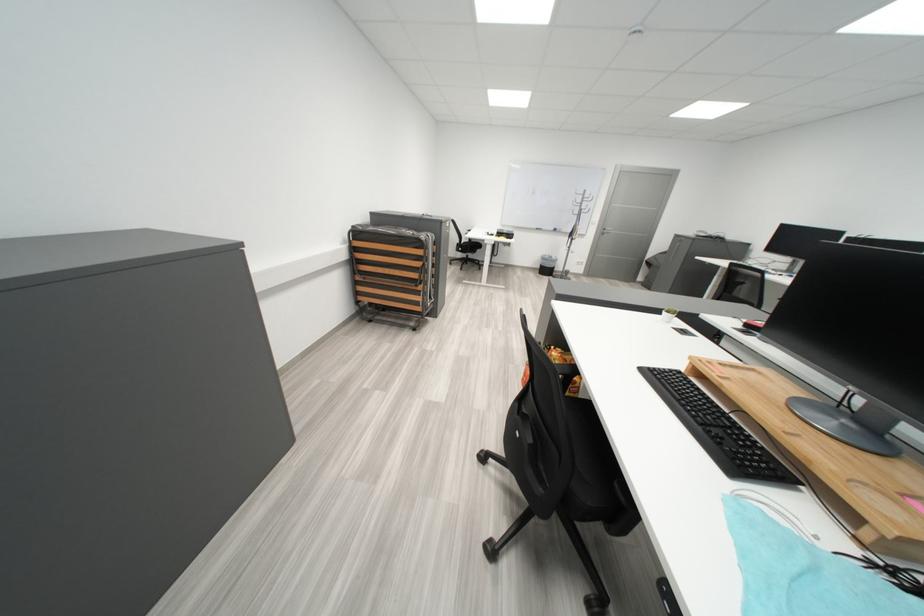
Where would you lift the black trash can? Please return your answer as a coordinate pair (x, y).

(546, 265)